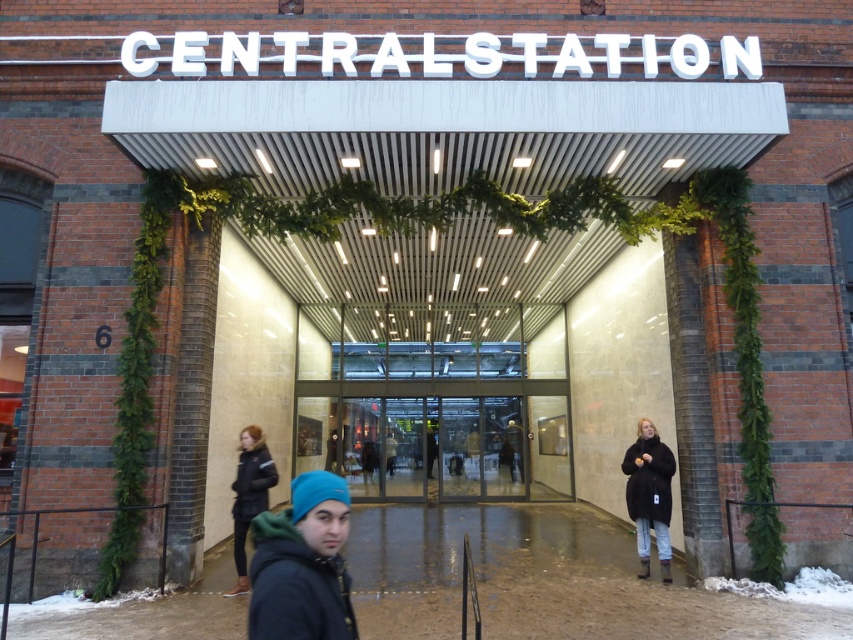
Based on the photo, can you confirm if black fuzzy coat at lower right is wider than white fluffy snow at lower right?

No.

Is point (650, 433) positioned behind point (772, 586)?

Yes, it is behind point (772, 586).

The height and width of the screenshot is (640, 853). What are the coordinates of `black fuzzy coat at lower right` in the screenshot? It's located at (648, 493).

Can you confirm if transparent glass doors at center is taller than blue knit cap at lower center?

Correct, transparent glass doors at center is much taller as blue knit cap at lower center.

Which of these two, transparent glass doors at center or blue knit cap at lower center, stands shorter?

With less height is blue knit cap at lower center.

Is point (367, 486) more distant than point (305, 602)?

Yes, point (367, 486) is behind point (305, 602).

Locate an element on the screen. transparent glass doors at center is located at coordinates (439, 440).

Is blue knit cap at lower center to the left of white fluffy snow at lower right from the viewer's perspective?

Indeed, blue knit cap at lower center is positioned on the left side of white fluffy snow at lower right.

Does point (264, 522) come farther from viewer compared to point (844, 592)?

No, it is in front of (844, 592).

Find the location of a particular element. The image size is (853, 640). blue knit cap at lower center is located at coordinates (302, 564).

At what (x,y) coordinates should I click in order to perform the action: click on blue knit cap at lower center. Please return your answer as a coordinate pair (x, y). This screenshot has height=640, width=853. Looking at the image, I should click on (302, 564).